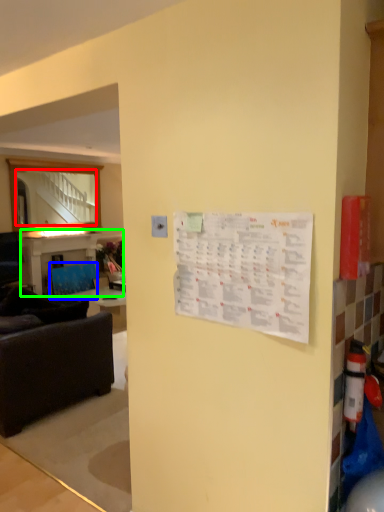
Question: Which object is the closest to the mirror (highlighted by a red box)? Choose among these: armchair (highlighted by a blue box) or table (highlighted by a green box).

Choices:
 (A) armchair
 (B) table

Answer: (B)